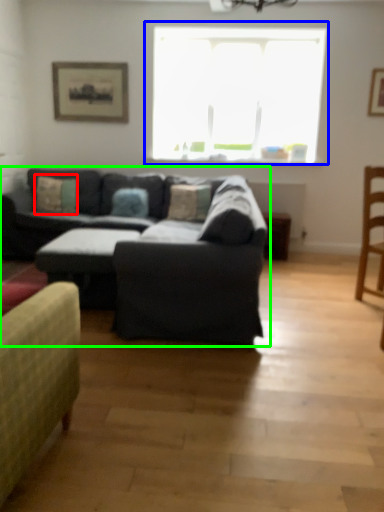
Question: Which is farther away from pillow (highlighted by a red box)? window (highlighted by a blue box) or studio couch (highlighted by a green box)?

Choices:
 (A) window
 (B) studio couch

Answer: (A)